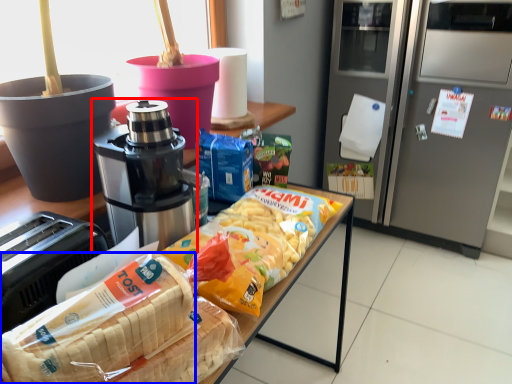
Question: Among these objects, which one is farthest to the camera, coffee maker (highlighted by a red box) or cereal (highlighted by a blue box)?

Choices:
 (A) coffee maker
 (B) cereal

Answer: (A)